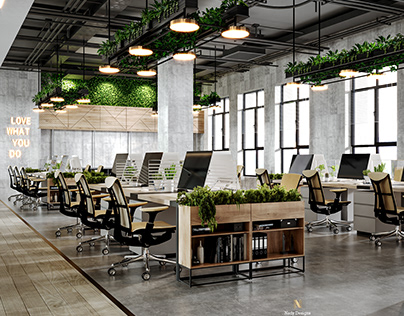
Find the location of `binders`. binders is located at coordinates (252, 245), (258, 245), (261, 245), (266, 246).